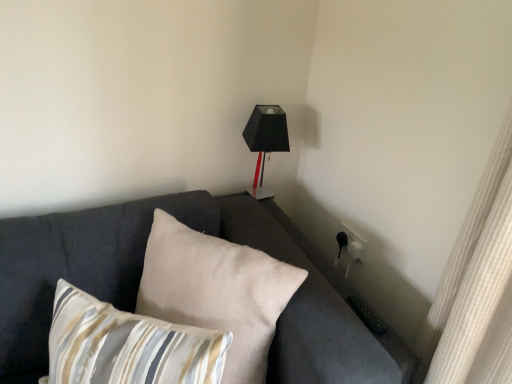
Question: Based on their sizes in the image, would you say striped fabric pillow at lower left, placed as the 2th pillow when sorted from back to front, is bigger or smaller than beige fabric pillow at center, which is the first pillow in back-to-front order?

Choices:
 (A) big
 (B) small

Answer: (B)

Question: From the image's perspective, is striped fabric pillow at lower left, placed as the 2th pillow when sorted from back to front, located above or below beige fabric pillow at center, which is the first pillow in back-to-front order?

Choices:
 (A) below
 (B) above

Answer: (A)

Question: Based on their relative distances, which object is nearer to the beige fabric pillow at center, which is the first pillow in back-to-front order?

Choices:
 (A) dark gray fabric couch at center
 (B) striped fabric pillow at lower left, positioned as the 1th pillow in front-to-back order
 (C) matte black lampshade at upper right

Answer: (A)

Question: Which of these objects is positioned farthest from the dark gray fabric couch at center?

Choices:
 (A) matte black lampshade at upper right
 (B) beige fabric pillow at center, which appears as the second pillow when viewed from the front
 (C) striped fabric pillow at lower left, placed as the 2th pillow when sorted from back to front

Answer: (A)